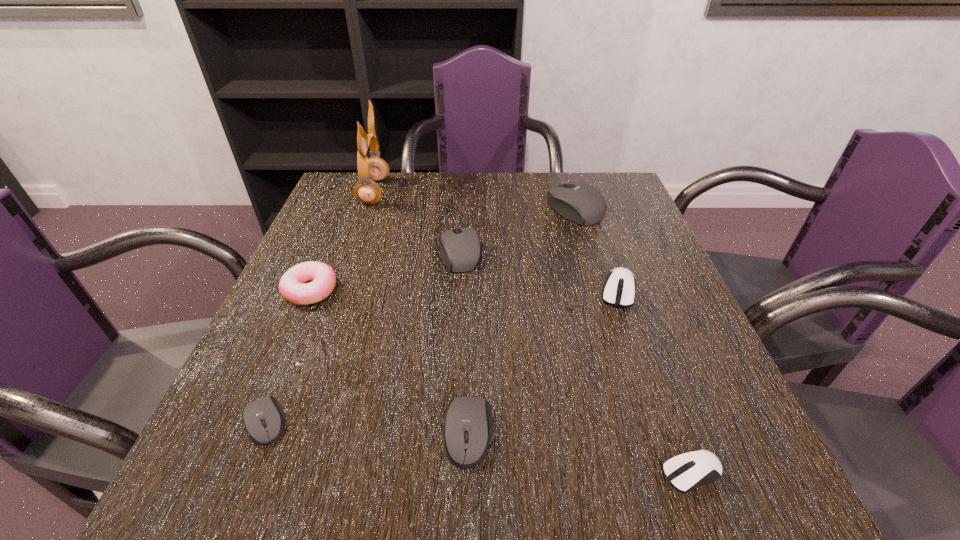
You are a GUI agent. You are given a task and a screenshot of the screen. Output one action in this format:
    pyautogui.click(x=<x>, y=<y>)
    Task: Click on the computer equipment situated at the far edge
    This screenshot has width=960, height=540.
    Given the screenshot: What is the action you would take?
    pyautogui.click(x=579, y=202)

Find the location of `earphone that is at the left edge`. earphone that is at the left edge is located at coordinates (367, 191).

I want to click on doughnut located in the left edge section of the desktop, so click(292, 286).

Where is `computer equipment that is at the left edge`? This screenshot has width=960, height=540. computer equipment that is at the left edge is located at coordinates 266,408.

The image size is (960, 540). Find the location of `object that is at the far left corner`. object that is at the far left corner is located at coordinates (367, 191).

Locate an element on the screen. object that is at the far right corner is located at coordinates (579, 202).

Find the location of `object that is positioned at the near right corner`. object that is positioned at the near right corner is located at coordinates (686, 471).

In the image, there is a desktop. At what (x,y) coordinates should I click in order to perform the action: click on vacant space at the far edge. Please return your answer as a coordinate pair (x, y). This screenshot has height=540, width=960. Looking at the image, I should click on (546, 200).

The image size is (960, 540). Identify the location of vacant area at the near edge. (342, 517).

Locate an element on the screen. Image resolution: width=960 pixels, height=540 pixels. free point at the left edge is located at coordinates (312, 244).